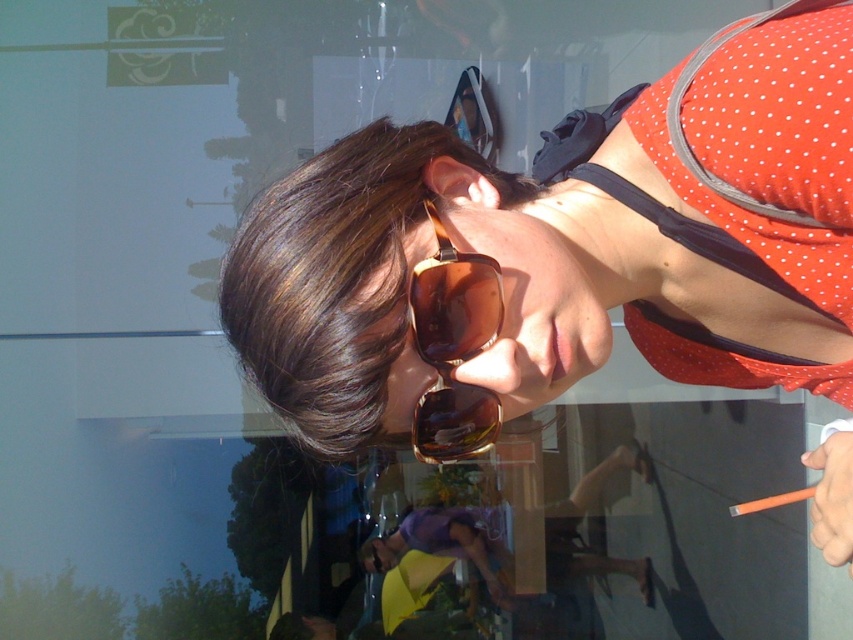
Is matte gold sunglasses at upper center smaller than brown shiny hair at center?

No.

Which is more to the left, matte gold sunglasses at upper center or brown shiny hair at center?

brown shiny hair at center is more to the left.

Locate an element on the screen. Image resolution: width=853 pixels, height=640 pixels. matte gold sunglasses at upper center is located at coordinates (569, 244).

Is brown shiny hair at center thinner than brown matte sunglasses at center?

In fact, brown shiny hair at center might be wider than brown matte sunglasses at center.

Between point (256, 211) and point (440, 234), which one is positioned in front?

Point (440, 234)

This screenshot has width=853, height=640. In order to click on brown shiny hair at center in this screenshot , I will do `click(335, 276)`.

Does matte gold sunglasses at upper center have a smaller size compared to brown matte sunglasses at center?

Actually, matte gold sunglasses at upper center might be larger than brown matte sunglasses at center.

Based on the photo, who is shorter, matte gold sunglasses at upper center or brown matte sunglasses at center?

Standing shorter between the two is brown matte sunglasses at center.

Identify the location of matte gold sunglasses at upper center. (569, 244).